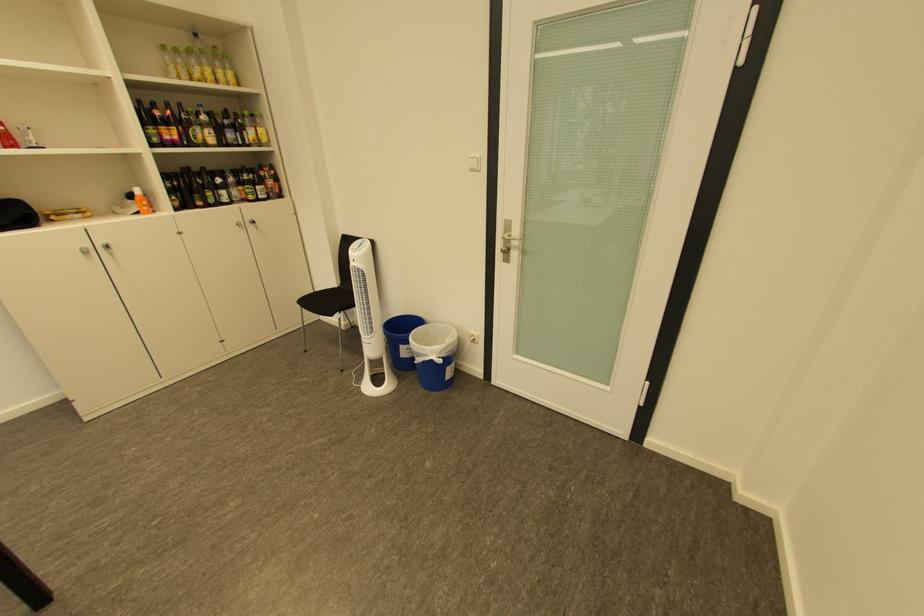
The height and width of the screenshot is (616, 924). What are the coordinates of `chair sitting surface` in the screenshot? It's located at (325, 299).